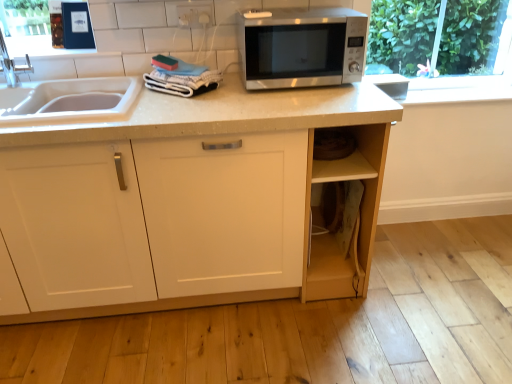
This screenshot has height=384, width=512. Find the location of `free spot in front of satin silver microwave at center`. free spot in front of satin silver microwave at center is located at coordinates (305, 99).